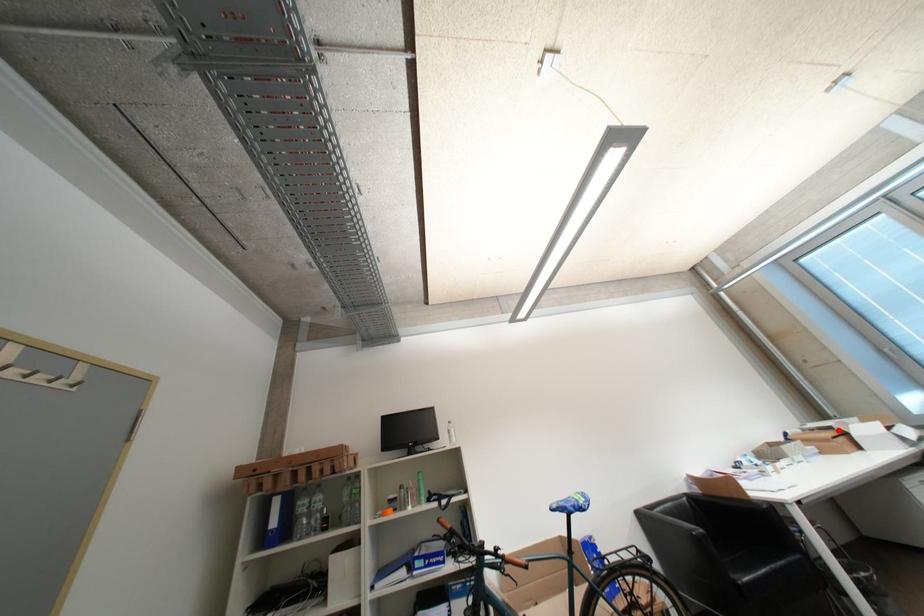
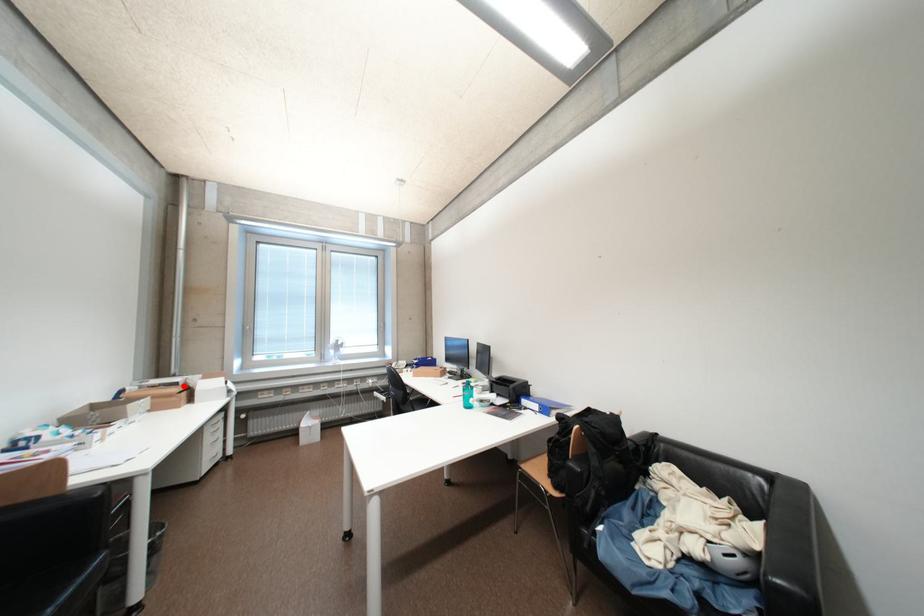
I am providing you with two images of the same scene from different viewpoints. A red point is marked on the first image and another point is marked on the second image. Does the point marked in image1 correspond to the same location as the one in image2?

Yes